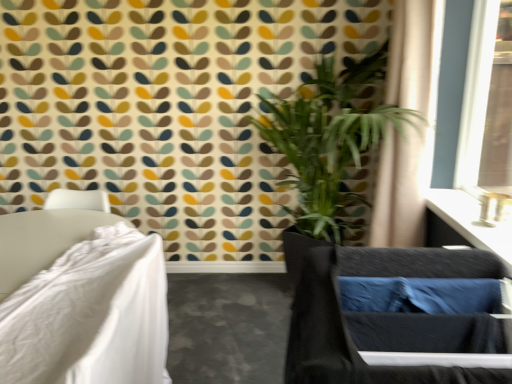
Question: Can you confirm if beige fabric curtain at upper right is taller than satin black vanity at upper right?

Choices:
 (A) no
 (B) yes

Answer: (B)

Question: Could satin black vanity at upper right be considered to be inside beige fabric curtain at upper right?

Choices:
 (A) yes
 (B) no

Answer: (B)

Question: Is beige fabric curtain at upper right wider than satin black vanity at upper right?

Choices:
 (A) yes
 (B) no

Answer: (A)

Question: Is beige fabric curtain at upper right facing towards satin black vanity at upper right?

Choices:
 (A) yes
 (B) no

Answer: (B)

Question: Is the depth of beige fabric curtain at upper right less than that of satin black vanity at upper right?

Choices:
 (A) yes
 (B) no

Answer: (B)

Question: From the image's perspective, is beige fabric curtain at upper right below satin black vanity at upper right?

Choices:
 (A) no
 (B) yes

Answer: (A)

Question: Is satin black vanity at upper right to the left of green leafy plant at center from the viewer's perspective?

Choices:
 (A) no
 (B) yes

Answer: (A)

Question: Is the depth of satin black vanity at upper right greater than that of green leafy plant at center?

Choices:
 (A) no
 (B) yes

Answer: (A)

Question: Is satin black vanity at upper right facing towards green leafy plant at center?

Choices:
 (A) yes
 (B) no

Answer: (B)

Question: From the image's perspective, is satin black vanity at upper right under green leafy plant at center?

Choices:
 (A) no
 (B) yes

Answer: (B)

Question: From a real-world perspective, is satin black vanity at upper right under green leafy plant at center?

Choices:
 (A) no
 (B) yes

Answer: (B)

Question: Is green leafy plant at center at the back of satin black vanity at upper right?

Choices:
 (A) no
 (B) yes

Answer: (A)

Question: Is satin black vanity at upper right inside green leafy plant at center?

Choices:
 (A) no
 (B) yes

Answer: (A)